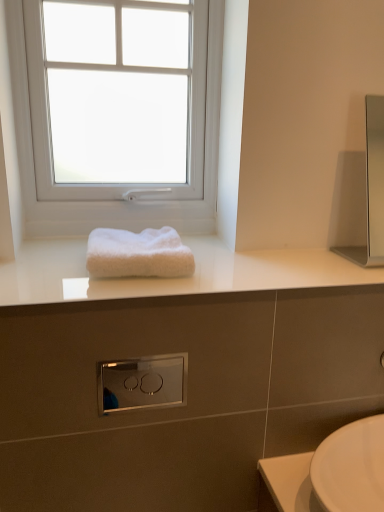
Question: From the image's perspective, does satin chrome switch at center appear lower than white plastic window at upper center?

Choices:
 (A) yes
 (B) no

Answer: (A)

Question: From the image's perspective, is satin chrome switch at center on top of white plastic window at upper center?

Choices:
 (A) no
 (B) yes

Answer: (A)

Question: Does satin chrome switch at center have a greater width compared to white plastic window at upper center?

Choices:
 (A) no
 (B) yes

Answer: (A)

Question: Is the depth of satin chrome switch at center greater than that of white plastic window at upper center?

Choices:
 (A) yes
 (B) no

Answer: (B)

Question: Is satin chrome switch at center smaller than white plastic window at upper center?

Choices:
 (A) no
 (B) yes

Answer: (B)

Question: Is satin chrome switch at center not near white plastic window at upper center?

Choices:
 (A) yes
 (B) no

Answer: (A)

Question: Is white plastic window at upper center bigger than white fluffy towel at center?

Choices:
 (A) yes
 (B) no

Answer: (A)

Question: Can you confirm if white plastic window at upper center is smaller than white fluffy towel at center?

Choices:
 (A) yes
 (B) no

Answer: (B)

Question: Is white plastic window at upper center at the left side of white fluffy towel at center?

Choices:
 (A) yes
 (B) no

Answer: (A)

Question: Is white plastic window at upper center turned away from white fluffy towel at center?

Choices:
 (A) yes
 (B) no

Answer: (B)

Question: Is white plastic window at upper center outside of white fluffy towel at center?

Choices:
 (A) no
 (B) yes

Answer: (B)

Question: Would you consider white plastic window at upper center to be distant from white fluffy towel at center?

Choices:
 (A) no
 (B) yes

Answer: (A)

Question: Is satin silver medicine cabinet at right turned away from satin chrome switch at center?

Choices:
 (A) no
 (B) yes

Answer: (A)